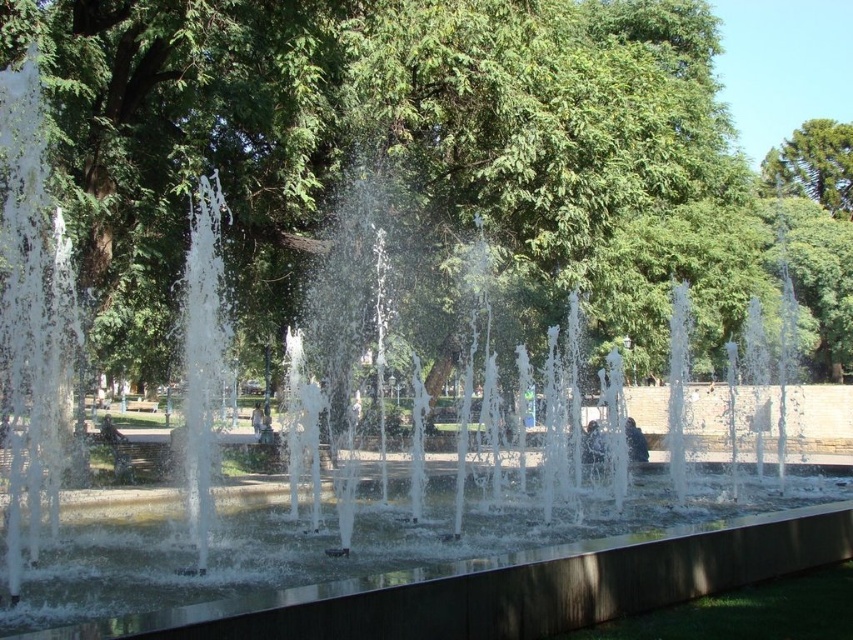
Question: Which point appears closest to the camera in this image?

Choices:
 (A) (830, 176)
 (B) (509, 220)

Answer: (B)

Question: Which of the following is the closest to the observer?

Choices:
 (A) (260, 184)
 (B) (801, 154)

Answer: (A)

Question: From the image, what is the correct spatial relationship of green leafy tree at center in relation to green leafy tree at upper right?

Choices:
 (A) right
 (B) left

Answer: (B)

Question: Can you confirm if green leafy tree at center is thinner than green leafy tree at upper right?

Choices:
 (A) no
 (B) yes

Answer: (A)

Question: Is green leafy tree at center positioned behind green leafy tree at upper right?

Choices:
 (A) no
 (B) yes

Answer: (A)